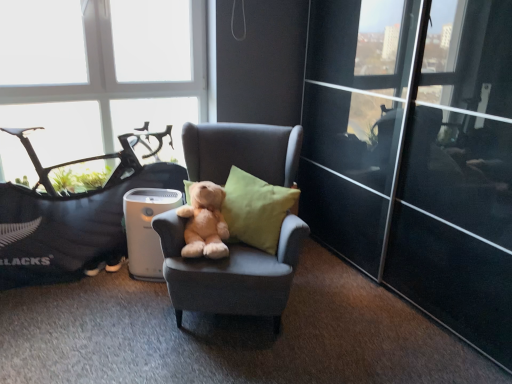
You are a GUI agent. You are given a task and a screenshot of the screen. Output one action in this format:
    pyautogui.click(x=<x>, y=<y>)
    Task: Click on the free space that is in between matte gray armchair at center and soft gray bean bag chair at left
    
    Given the screenshot: What is the action you would take?
    pyautogui.click(x=100, y=302)